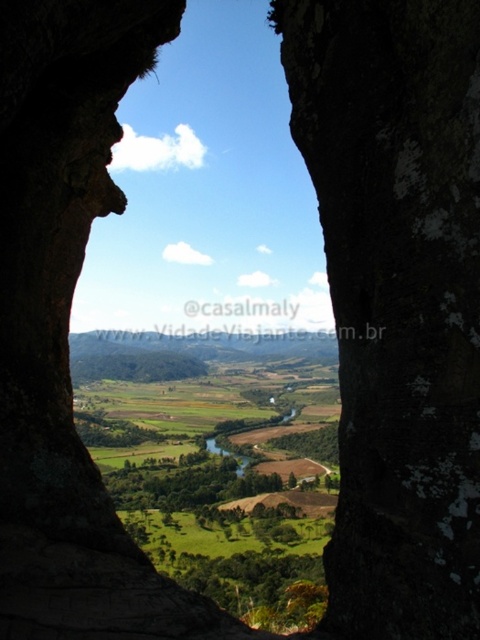
Does point (471, 426) lie in front of point (242, 464)?

Yes, point (471, 426) is closer to viewer.

Can you confirm if dark brown textured rock at center is smaller than green grassy river at center?

Yes, dark brown textured rock at center is smaller than green grassy river at center.

What do you see at coordinates (397, 300) in the screenshot? This screenshot has width=480, height=640. I see `dark brown textured rock at center` at bounding box center [397, 300].

This screenshot has height=640, width=480. Identify the location of dark brown textured rock at center. (x=397, y=300).

Does brown rough rock at center appear over green grassy field at center?

Yes, brown rough rock at center is above green grassy field at center.

Who is more distant from viewer, (172, 113) or (76, 355)?

The point (172, 113) is more distant.

Locate an element on the screen. The width and height of the screenshot is (480, 640). brown rough rock at center is located at coordinates (208, 192).

Can you confirm if brown rough rock at center is positioned above green grassy river at center?

Correct, brown rough rock at center is located above green grassy river at center.

Where is `brown rough rock at center`? This screenshot has width=480, height=640. brown rough rock at center is located at coordinates (208, 192).